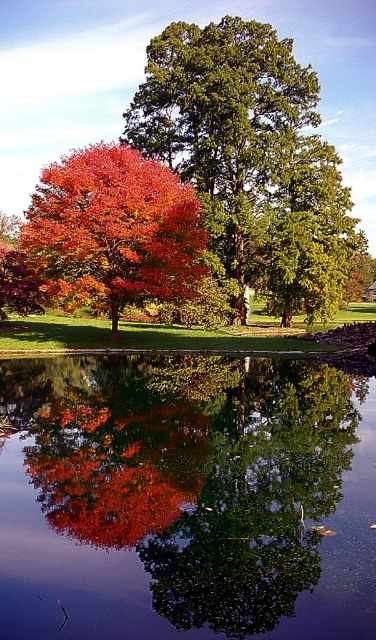
Does point (151, 244) lie behind point (103, 472)?

That is True.

Find the location of `shiny red maple tree at left`. shiny red maple tree at left is located at coordinates (113, 230).

Is point (110, 248) farther from camera compared to point (39, 468)?

Yes, it is.

The image size is (376, 640). I want to click on shiny red maple tree at left, so click(113, 230).

Can you confirm if smooth glass lake at center is positioned above shiny red leaves at center?

Yes, smooth glass lake at center is above shiny red leaves at center.

Who is higher up, smooth glass lake at center or shiny red leaves at center?

smooth glass lake at center is higher up.

Locate an element on the screen. Image resolution: width=376 pixels, height=640 pixels. smooth glass lake at center is located at coordinates (186, 499).

You are a GUI agent. You are given a task and a screenshot of the screen. Output one action in this format:
    pyautogui.click(x=<x>, y=<y>)
    Task: Click on the smooth glass lake at center
    This screenshot has width=376, height=640.
    Given the screenshot: What is the action you would take?
    pyautogui.click(x=186, y=499)

How far apart are green textured tree at center and shiny red maple tree at left?

green textured tree at center is 27.12 feet from shiny red maple tree at left.

Which is more to the left, green textured tree at center or shiny red maple tree at left?

From the viewer's perspective, shiny red maple tree at left appears more on the left side.

Is point (336, 163) positioned before point (53, 280)?

No, it is behind (53, 280).

You are a GUI agent. You are given a task and a screenshot of the screen. Output one action in this format:
    pyautogui.click(x=<x>, y=<y>)
    Task: Click on the green textured tree at center
    The height and width of the screenshot is (640, 376).
    Given the screenshot: What is the action you would take?
    pyautogui.click(x=250, y=156)